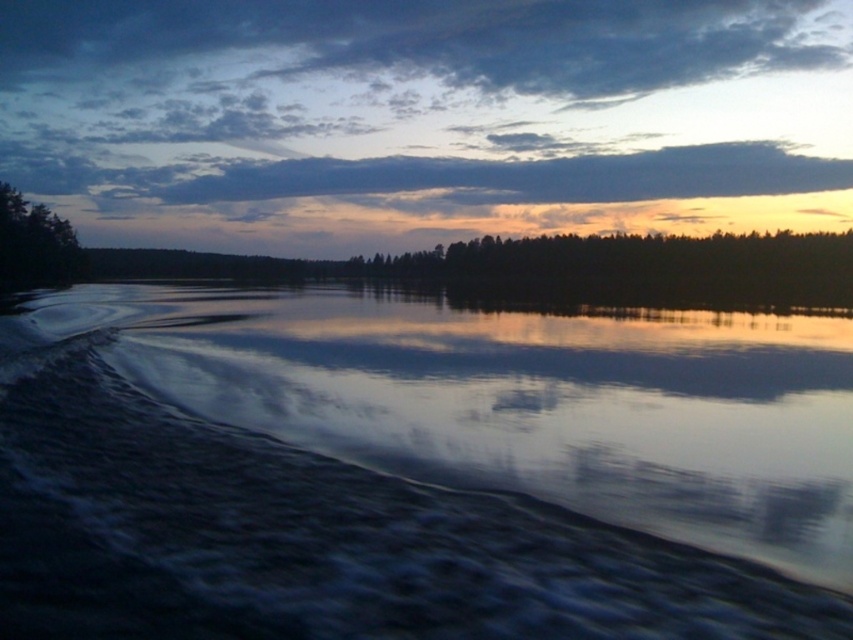
Question: Estimate the real-world distances between objects in this image. Which object is closer to the dark reflective water at lower left?

Choices:
 (A) green matte trees at center
 (B) green matte tree at left

Answer: (A)

Question: Among these objects, which one is farthest from the camera?

Choices:
 (A) green matte tree at left
 (B) dark reflective water at lower left

Answer: (A)

Question: Does dark reflective water at lower left have a smaller size compared to green matte trees at center?

Choices:
 (A) yes
 (B) no

Answer: (A)

Question: Is dark reflective water at lower left smaller than green matte trees at center?

Choices:
 (A) no
 (B) yes

Answer: (B)

Question: Which object is farther from the camera taking this photo?

Choices:
 (A) dark reflective water at lower left
 (B) green matte tree at left

Answer: (B)

Question: Is green matte trees at center bigger than green matte tree at left?

Choices:
 (A) yes
 (B) no

Answer: (A)